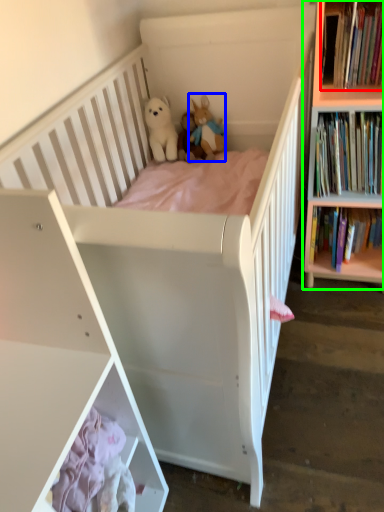
Question: Based on their relative distances, which object is nearer to book (highlighted by a red box)? Choose from toy (highlighted by a blue box) and bookcase (highlighted by a green box).

Choices:
 (A) toy
 (B) bookcase

Answer: (B)